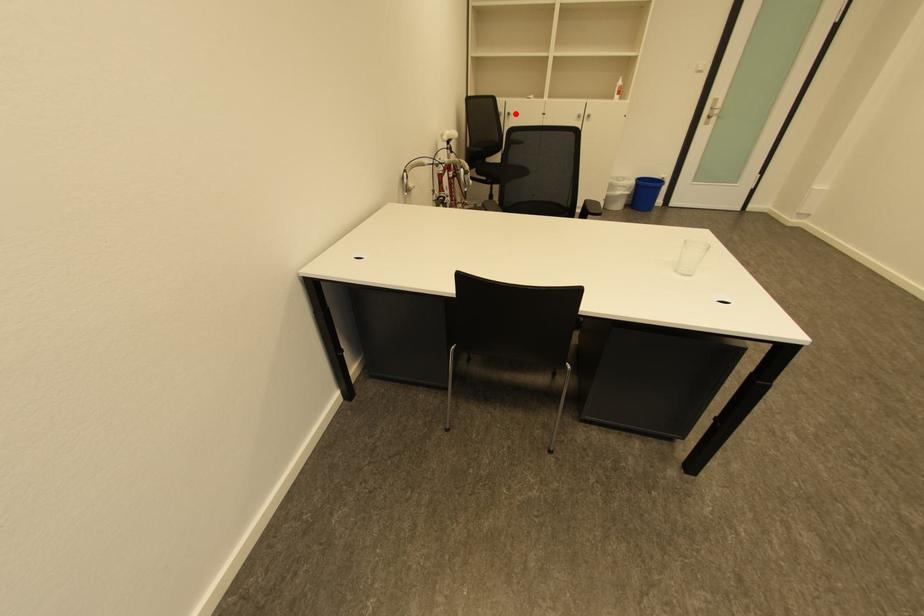
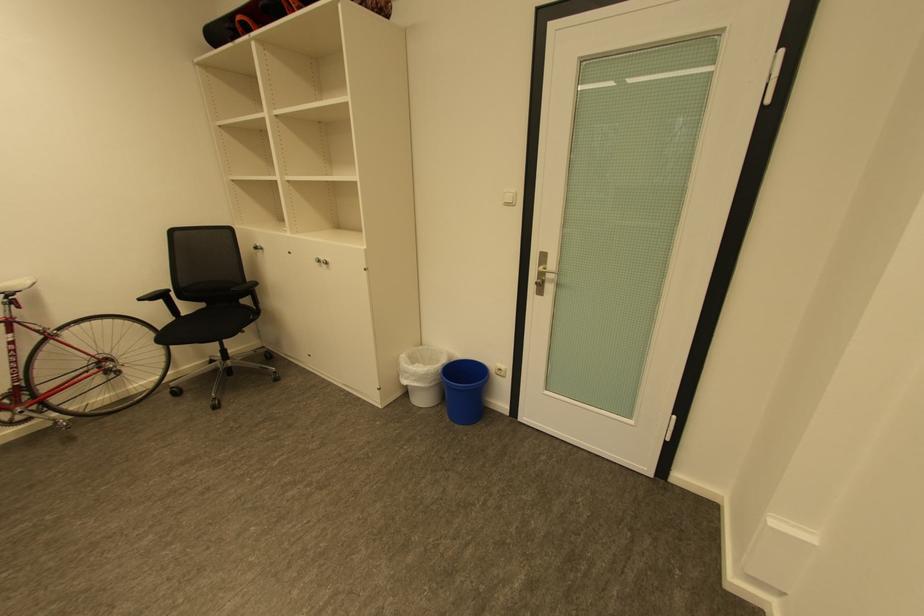
The point at the highlighted location is marked in the first image. Where is the corresponding point in the second image?

(262, 248)